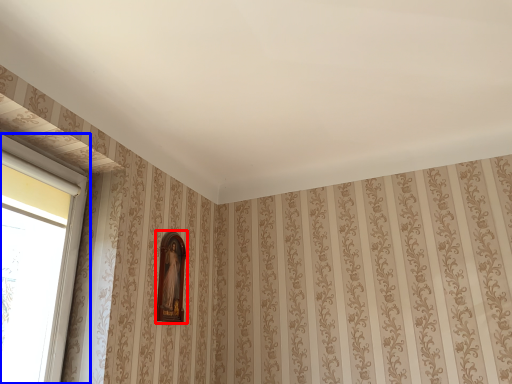
Question: Which object is further to the camera taking this photo, picture frame (highlighted by a red box) or window (highlighted by a blue box)?

Choices:
 (A) picture frame
 (B) window

Answer: (A)